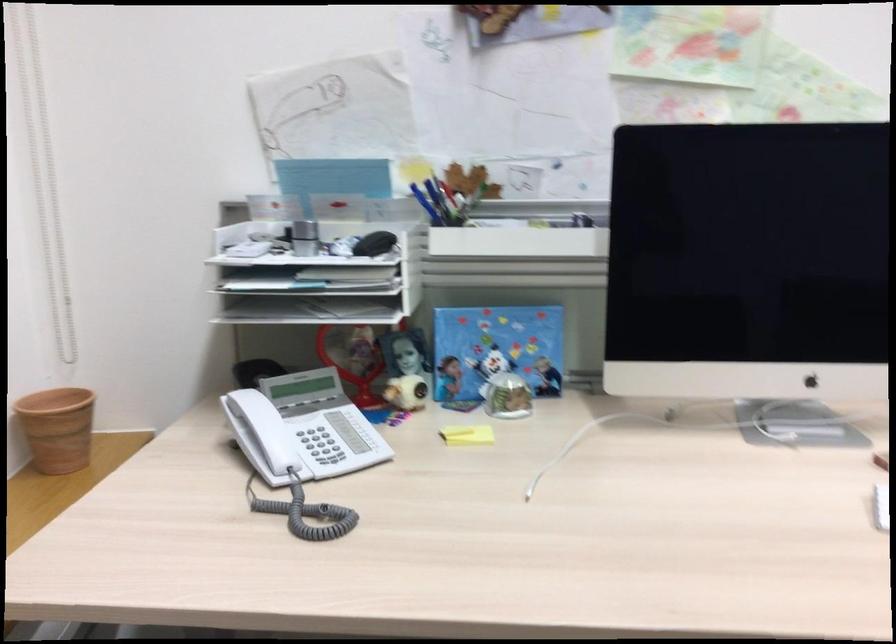
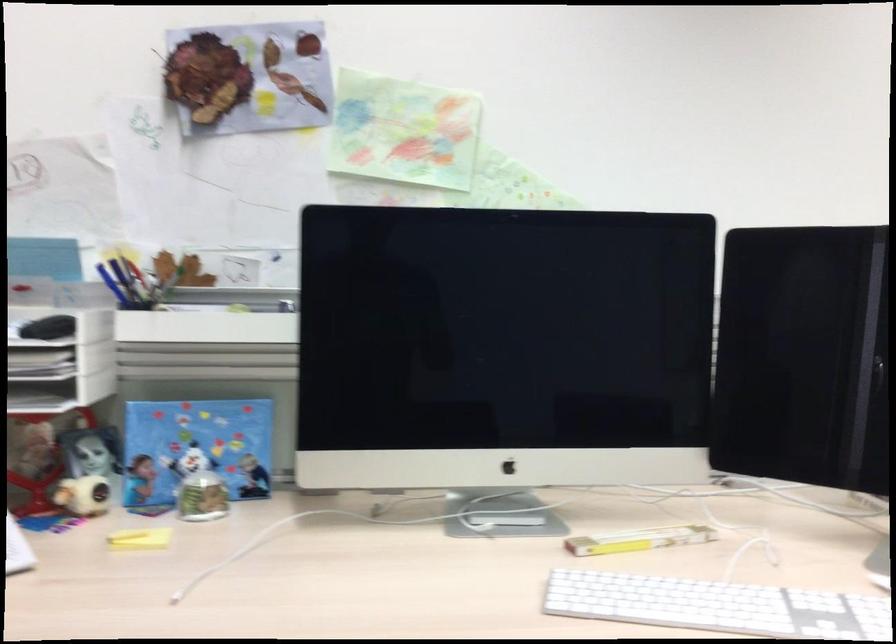
Question: The camera is either moving clockwise (left) or counter-clockwise (right) around the object. The first image is from the beginning of the video and the second image is from the end. Is the camera moving left or right when shooting the video?

Choices:
 (A) Left
 (B) Right

Answer: (A)